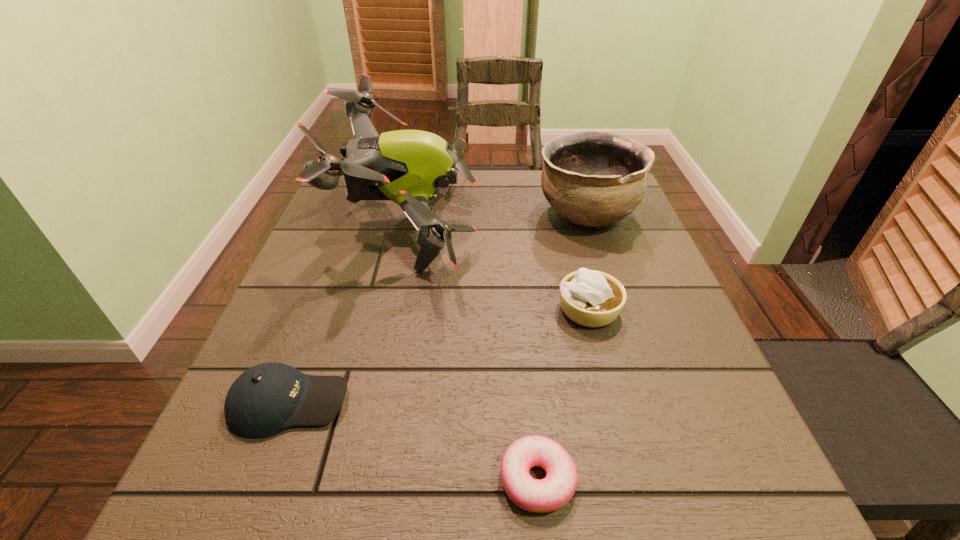
This screenshot has height=540, width=960. In order to click on object positioned at the far right corner in this screenshot , I will do `click(591, 178)`.

In the image, there is a desktop. In order to click on free space at the far edge in this screenshot , I will do `click(506, 212)`.

Image resolution: width=960 pixels, height=540 pixels. In the image, there is a desktop. Find the location of `free space at the near edge`. free space at the near edge is located at coordinates (637, 526).

In the image, there is a desktop. Find the location of `free space at the left edge`. free space at the left edge is located at coordinates (357, 307).

In the image, there is a desktop. Where is `blank space at the right edge`? This screenshot has width=960, height=540. blank space at the right edge is located at coordinates (596, 263).

The width and height of the screenshot is (960, 540). In order to click on free space at the near left corner of the desktop in this screenshot , I will do `click(214, 528)`.

The image size is (960, 540). Find the location of `vacant space at the near right corner of the desktop`. vacant space at the near right corner of the desktop is located at coordinates 692,503.

The height and width of the screenshot is (540, 960). I want to click on free spot between the second shortest object and the drone, so click(x=349, y=314).

Identify the location of free space between the fourth shortest object and the shortest object. (562, 347).

Where is `empty location between the nearest object and the second nearest object`? The width and height of the screenshot is (960, 540). empty location between the nearest object and the second nearest object is located at coordinates (414, 441).